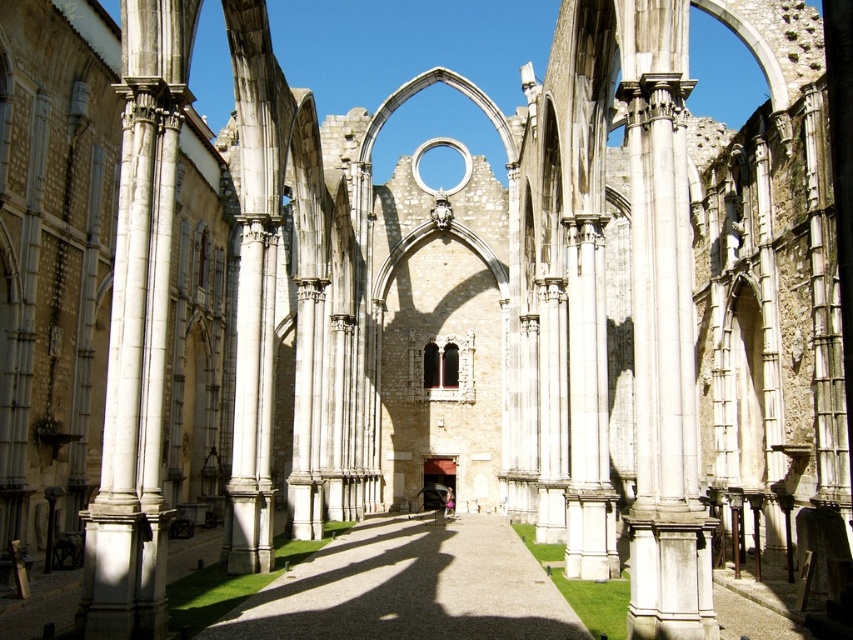
Between white marble column at left and gravel pathway at center, which one is positioned lower?

gravel pathway at center is lower down.

Is point (163, 321) behind point (329, 602)?

No, (163, 321) is in front of (329, 602).

Describe the element at coordinates (138, 333) in the screenshot. I see `white marble column at left` at that location.

Identify the location of white marble column at left. (138, 333).